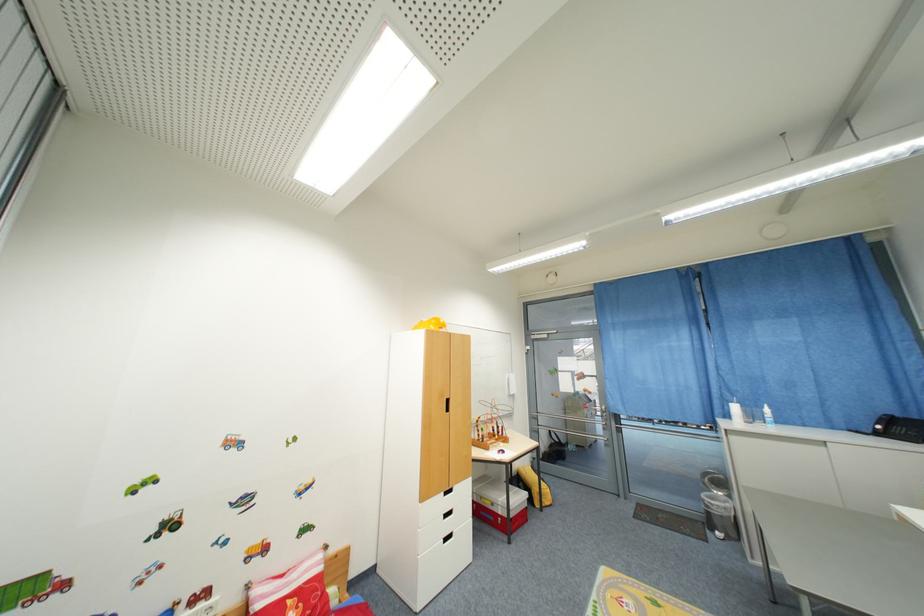
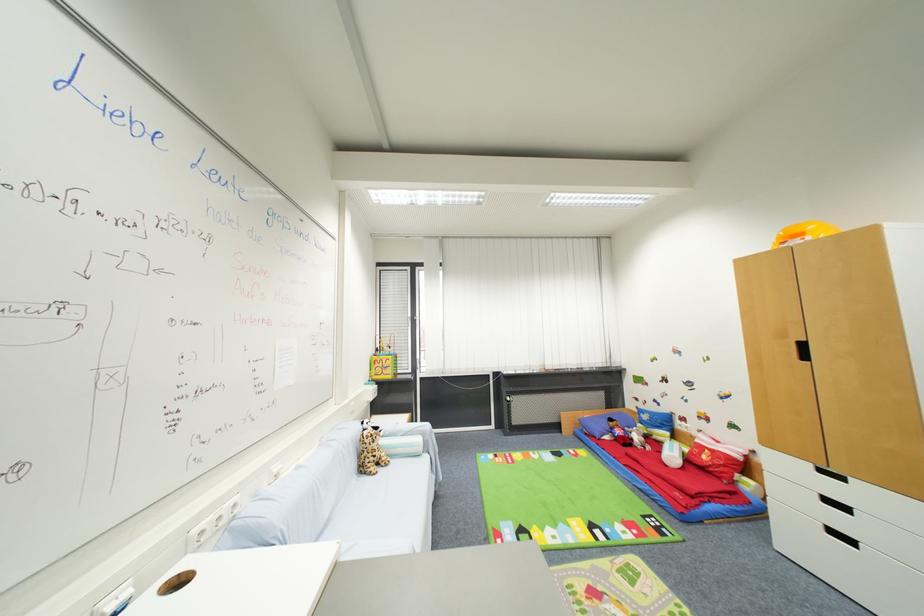
Locate, in the second image, the point that corresponds to the point at 456,537 in the first image.

(857, 544)